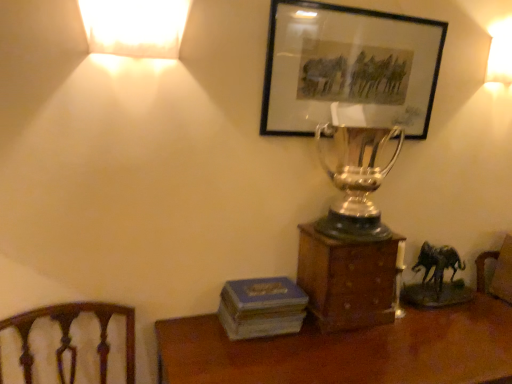
The width and height of the screenshot is (512, 384). What are the coordinates of `free spot to the right of wooden box at center` in the screenshot? It's located at (428, 334).